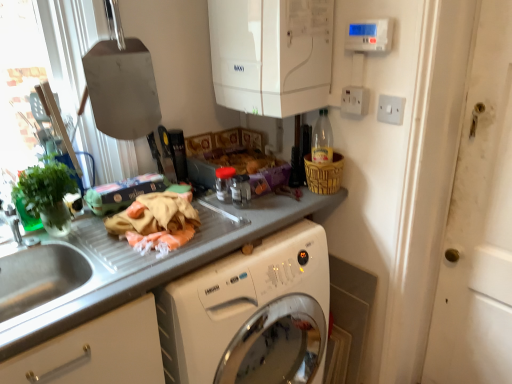
How much space does white glossy boiler at upper center, which appears as the third appliance when viewed from the left, occupy horizontally?

The width of white glossy boiler at upper center, which appears as the third appliance when viewed from the left, is 11.12 inches.

Measure the distance between brushed metal faucet at left and camera.

brushed metal faucet at left is 1.22 meters away from camera.

Locate an element on the screen. The image size is (512, 384). white matte door at right is located at coordinates (479, 223).

What is the approximate width of transparent plastic spice jar at center, which is counted as the 2th appliance, starting from the left?

It is 3.34 inches.

The image size is (512, 384). What do you see at coordinates (241, 191) in the screenshot?
I see `transparent plastic spice jar at center, which is counted as the 2th appliance, starting from the right` at bounding box center [241, 191].

Identify the location of white glossy boiler at upper center, which appears as the third appliance when viewed from the left. Image resolution: width=512 pixels, height=384 pixels. (271, 54).

From a real-world perspective, which object rests below the other?

In real-world perspective, green matte plant at left is lower.

What's the angular difference between white glossy boiler at upper center, the 1th appliance in the right-to-left sequence, and green matte plant at left's facing directions?

90 degrees separate the facing orientations of white glossy boiler at upper center, the 1th appliance in the right-to-left sequence, and green matte plant at left.

Locate an element on the screen. The image size is (512, 384). plant located in front of the white glossy boiler at upper center, the 1th appliance in the right-to-left sequence is located at coordinates (42, 193).

Considering the relative sizes of white glossy boiler at upper center, the 1th appliance in the right-to-left sequence, and green matte plant at left in the image provided, is white glossy boiler at upper center, the 1th appliance in the right-to-left sequence, wider than green matte plant at left?

Yes.

Which object is thinner, white matte door at right or brushed metal faucet at left?

brushed metal faucet at left.

Is brushed metal faucet at left completely or partially inside white matte door at right?

Definitely not — brushed metal faucet at left is not inside white matte door at right.

Is white matte door at right looking in the opposite direction of brushed metal faucet at left?

No, white matte door at right is not facing the opposite direction of brushed metal faucet at left.

Which is more to the right, green matte plant at left or white matte door at right?

Positioned to the right is white matte door at right.

Considering the sizes of green matte plant at left and white matte door at right in the image, is green matte plant at left wider or thinner than white matte door at right?

Considering their sizes, green matte plant at left looks broader than white matte door at right.

From the image's perspective, between green matte plant at left and white matte door at right, which one is located above?

green matte plant at left, from the image's perspective.

How many degrees apart are the facing directions of green matte plant at left and white matte door at right?

There is a 91.8-degree angle between the facing directions of green matte plant at left and white matte door at right.

Considering the relative sizes of brushed metal faucet at left and white glossy boiler at upper center, which appears as the third appliance when viewed from the left, in the image provided, is brushed metal faucet at left thinner than white glossy boiler at upper center, which appears as the third appliance when viewed from the left,?

Correct, the width of brushed metal faucet at left is less than that of white glossy boiler at upper center, which appears as the third appliance when viewed from the left.

Is brushed metal faucet at left in contact with white glossy boiler at upper center, which appears as the third appliance when viewed from the left?

No.

Which object is closer to the camera, brushed metal faucet at left or white glossy boiler at upper center, the 1th appliance in the right-to-left sequence?

white glossy boiler at upper center, the 1th appliance in the right-to-left sequence, is closer to the camera.

From the image's perspective, which is above, brushed metal faucet at left or white glossy boiler at upper center, the 1th appliance in the right-to-left sequence?

white glossy boiler at upper center, the 1th appliance in the right-to-left sequence, from the image's perspective.

Is metallic silver spatula at upper left, the 1th appliance from the left, in front of green matte plant at left?

No, the depth of metallic silver spatula at upper left, the 1th appliance from the left, is greater than that of green matte plant at left.

Can you tell me how much metallic silver spatula at upper left, the 1th appliance from the left, and green matte plant at left differ in facing direction?

1.56 degrees separate the facing orientations of metallic silver spatula at upper left, the 1th appliance from the left, and green matte plant at left.

Which is nearer, (139, 125) or (29, 217)?

The point (29, 217) is closer to the camera.

Considering the sizes of metallic silver spatula at upper left, the 1th appliance from the left, and green matte plant at left in the image, is metallic silver spatula at upper left, the 1th appliance from the left, wider or thinner than green matte plant at left?

metallic silver spatula at upper left, the 1th appliance from the left, is thinner than green matte plant at left.

Is green matte plant at left not inside brushed metal faucet at left?

green matte plant at left lies outside brushed metal faucet at left's area.

In terms of width, does green matte plant at left look wider or thinner when compared to brushed metal faucet at left?

green matte plant at left is wider than brushed metal faucet at left.

How different are the orientations of green matte plant at left and brushed metal faucet at left in degrees?

The angular difference between green matte plant at left and brushed metal faucet at left is 2.44 degrees.

From a real-world perspective, is green matte plant at left on top of brushed metal faucet at left?

Correct, in the physical world, green matte plant at left is higher than brushed metal faucet at left.

Does white plastic electric outlet at upper right, the 1th electric outlet viewed from the left, have a larger size compared to woven brown basket at upper right?

No, white plastic electric outlet at upper right, the 1th electric outlet viewed from the left, is not bigger than woven brown basket at upper right.

Considering the points (356, 94) and (343, 157), which point is behind, point (356, 94) or point (343, 157)?

Positioned behind is point (343, 157).

From a real-world perspective, is white plastic electric outlet at upper right, positioned as the 2th electric outlet in right-to-left order, beneath woven brown basket at upper right?

No, from a real-world perspective, white plastic electric outlet at upper right, positioned as the 2th electric outlet in right-to-left order, is not under woven brown basket at upper right.

How many degrees apart are the facing directions of white plastic electric outlet at upper right, the 1th electric outlet viewed from the left, and woven brown basket at upper right?

white plastic electric outlet at upper right, the 1th electric outlet viewed from the left, and woven brown basket at upper right are facing 178 degrees away from each other.

I want to click on appliance that is the 2nd one above the green matte plant at left (from a real-world perspective), so click(x=271, y=54).

Locate an element on the screen. This screenshot has width=512, height=384. faucet behind the white matte door at right is located at coordinates (13, 223).

Based on their spatial positions, is smooth gray countertop at center or woven brown basket at upper right closer to white plastic electric outlet at upper right, positioned as the 2th electric outlet in right-to-left order?

woven brown basket at upper right is positioned closer to the anchor white plastic electric outlet at upper right, positioned as the 2th electric outlet in right-to-left order.

Based on their spatial positions, is white matte door at right or woven brown basket at upper right further from brushed metal faucet at left?

Based on the image, white matte door at right appears to be further to brushed metal faucet at left.

Estimate the real-world distances between objects in this image. Which object is closer to white plastic switch at upper right, acting as the 2th electric outlet starting from the left, white glossy boiler at upper center, which appears as the third appliance when viewed from the left, or transparent plastic spice jar at center, which is counted as the 2th appliance, starting from the right?

Based on the image, white glossy boiler at upper center, which appears as the third appliance when viewed from the left, appears to be nearer to white plastic switch at upper right, acting as the 2th electric outlet starting from the left.

Which object lies nearer to the anchor point metallic silver spatula at upper left, the 1th appliance from the left, white matte door at right or brushed metal faucet at left?

brushed metal faucet at left lies closer to metallic silver spatula at upper left, the 1th appliance from the left, than the other object.

Which object lies further to the anchor point white plastic switch at upper right, acting as the 2th electric outlet starting from the left, white plastic electric outlet at upper right, positioned as the 2th electric outlet in right-to-left order, or transparent plastic spice jar at center, which is counted as the 2th appliance, starting from the right?

transparent plastic spice jar at center, which is counted as the 2th appliance, starting from the right, lies further to white plastic switch at upper right, acting as the 2th electric outlet starting from the left, than the other object.

From the image, which object appears to be farther from brushed metal faucet at left, white glossy boiler at upper center, the 1th appliance in the right-to-left sequence, or white plastic switch at upper right, placed as the 1th electric outlet when sorted from right to left?

The object further to brushed metal faucet at left is white plastic switch at upper right, placed as the 1th electric outlet when sorted from right to left.

Looking at the image, which one is located further to white matte door at right, brushed metal faucet at left or metallic silver spatula at upper left, placed as the third appliance when sorted from right to left?

Among the two, brushed metal faucet at left is located further to white matte door at right.

Looking at the image, which one is located closer to white matte door at right, woven brown basket at upper right or transparent plastic spice jar at center, which is counted as the 2th appliance, starting from the right?

The object closer to white matte door at right is woven brown basket at upper right.

Find the location of a particular element. Image resolution: width=512 pixels, height=384 pixels. appliance between metallic silver spatula at upper left, placed as the third appliance when sorted from right to left, and white glossy boiler at upper center, which appears as the third appliance when viewed from the left, from left to right is located at coordinates (241, 191).

The height and width of the screenshot is (384, 512). Identify the location of electric outlet between white plastic electric outlet at upper right, positioned as the 2th electric outlet in right-to-left order, and smooth gray countertop at center from top to bottom. (391, 109).

The width and height of the screenshot is (512, 384). What are the coordinates of `basket between brushed metal faucet at left and white matte door at right in the horizontal direction` in the screenshot? It's located at (324, 174).

The image size is (512, 384). In order to click on countertop between green matte plant at left and woven brown basket at upper right from left to right in this screenshot , I will do `click(172, 265)`.